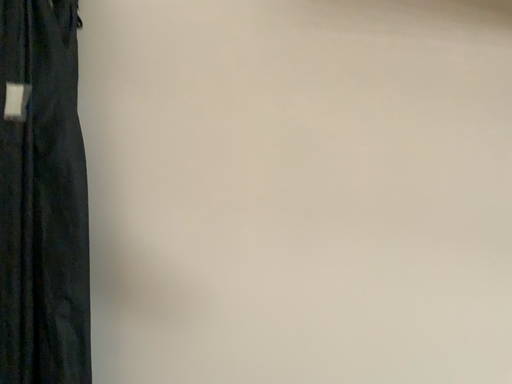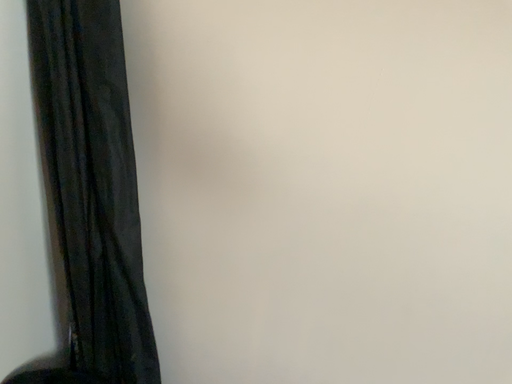
Question: Which way did the camera rotate in the video?

Choices:
 (A) rotated right
 (B) rotated left

Answer: (B)